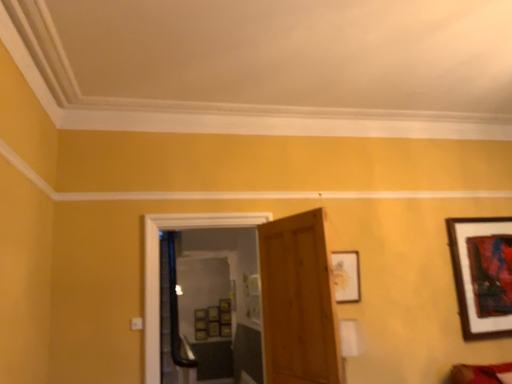
Question: Is wooden picture frame at center-right, the second picture frame positioned from the right, located outside wooden framed artwork at upper right, positioned as the first picture frame in back-to-front order?

Choices:
 (A) no
 (B) yes

Answer: (B)

Question: Can you confirm if wooden picture frame at center-right, which appears as the first picture frame when viewed from the left, is taller than wooden framed artwork at upper right, the 1th picture frame viewed from the right?

Choices:
 (A) no
 (B) yes

Answer: (A)

Question: Considering the relative sizes of wooden picture frame at center-right, the second picture frame positioned from the right, and wooden framed artwork at upper right, the 1th picture frame viewed from the right, in the image provided, is wooden picture frame at center-right, the second picture frame positioned from the right, smaller than wooden framed artwork at upper right, the 1th picture frame viewed from the right,?

Choices:
 (A) no
 (B) yes

Answer: (B)

Question: Considering the relative sizes of wooden picture frame at center-right, the first picture frame when ordered from front to back, and wooden framed artwork at upper right, the 1th picture frame viewed from the right, in the image provided, is wooden picture frame at center-right, the first picture frame when ordered from front to back, shorter than wooden framed artwork at upper right, the 1th picture frame viewed from the right,?

Choices:
 (A) no
 (B) yes

Answer: (B)

Question: Is wooden picture frame at center-right, the first picture frame when ordered from front to back, to the left of wooden framed artwork at upper right, positioned as the first picture frame in back-to-front order, from the viewer's perspective?

Choices:
 (A) yes
 (B) no

Answer: (A)

Question: In terms of height, does wooden door at center look taller or shorter compared to wooden picture frame at center-right, the first picture frame when ordered from front to back?

Choices:
 (A) tall
 (B) short

Answer: (A)

Question: Based on their positions, is wooden door at center located to the left or right of wooden picture frame at center-right, the first picture frame when ordered from front to back?

Choices:
 (A) right
 (B) left

Answer: (B)

Question: From the image's perspective, is wooden door at center positioned above or below wooden picture frame at center-right, the second picture frame positioned from the right?

Choices:
 (A) below
 (B) above

Answer: (A)

Question: In terms of width, does wooden door at center look wider or thinner when compared to wooden picture frame at center-right, the first picture frame when ordered from front to back?

Choices:
 (A) wide
 (B) thin

Answer: (A)

Question: Considering the positions of transparent glass door at center and wooden picture frame at center-right, marked as the 2th picture frame in a back-to-front arrangement, in the image, is transparent glass door at center bigger or smaller than wooden picture frame at center-right, marked as the 2th picture frame in a back-to-front arrangement,?

Choices:
 (A) small
 (B) big

Answer: (B)

Question: Is transparent glass door at center in front of or behind wooden picture frame at center-right, which appears as the first picture frame when viewed from the left, in the image?

Choices:
 (A) behind
 (B) front

Answer: (B)

Question: From their relative heights in the image, would you say transparent glass door at center is taller or shorter than wooden picture frame at center-right, marked as the 2th picture frame in a back-to-front arrangement?

Choices:
 (A) tall
 (B) short

Answer: (A)

Question: Is transparent glass door at center to the left or to the right of wooden picture frame at center-right, the first picture frame when ordered from front to back, in the image?

Choices:
 (A) right
 (B) left

Answer: (B)

Question: Looking at their shapes, would you say transparent glass door at center is wider or thinner than wooden door at center?

Choices:
 (A) wide
 (B) thin

Answer: (A)

Question: Is transparent glass door at center situated inside wooden door at center or outside?

Choices:
 (A) outside
 (B) inside

Answer: (A)